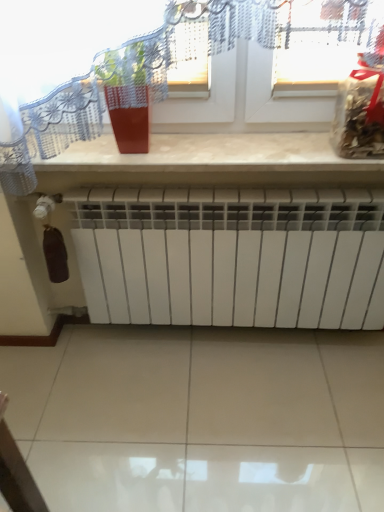
In order to face matte red pot at upper center, should I rotate leftwards or rightwards?

To align with it, rotate left about 8.091°.

Describe the element at coordinates (265, 65) in the screenshot. I see `transparent glass window at upper center` at that location.

Locate an element on the screen. This screenshot has height=512, width=384. matte red pot at upper center is located at coordinates (133, 87).

Which is behind, matte red pot at upper center or translucent plastic bag at upper right?

matte red pot at upper center.

Between matte red pot at upper center and translucent plastic bag at upper right, which one has larger size?

Bigger between the two is translucent plastic bag at upper right.

Is point (152, 93) closer or farther from the camera than point (356, 108)?

Point (152, 93) is positioned closer to the camera compared to point (356, 108).

Which object is thinner, matte red pot at upper center or translucent plastic bag at upper right?

With smaller width is matte red pot at upper center.

Considering the sizes of objects white matte radiator at lower center and transparent glass window at upper center in the image provided, who is taller, white matte radiator at lower center or transparent glass window at upper center?

white matte radiator at lower center is taller.

Considering the positions of objects white matte radiator at lower center and transparent glass window at upper center in the image provided, who is more to the left, white matte radiator at lower center or transparent glass window at upper center?

Positioned to the left is transparent glass window at upper center.

From the image's perspective, would you say white matte radiator at lower center is shown under transparent glass window at upper center?

Yes.

From a real-world perspective, is white matte radiator at lower center below transparent glass window at upper center?

Yes, from a real-world perspective, white matte radiator at lower center is under transparent glass window at upper center.

Is beige marble counter at upper center surrounded by matte red pot at upper center?

No, beige marble counter at upper center is not inside matte red pot at upper center.

From a real-world perspective, is matte red pot at upper center physically located above or below beige marble counter at upper center?

Clearly, from a real-world perspective, matte red pot at upper center is above beige marble counter at upper center.

Looking at this image, which of these two, matte red pot at upper center or beige marble counter at upper center, stands shorter?

Standing shorter between the two is beige marble counter at upper center.

Where is `houseplant in front of the beige marble counter at upper center`? Image resolution: width=384 pixels, height=512 pixels. houseplant in front of the beige marble counter at upper center is located at coordinates (133, 87).

From the image's perspective, is white matte radiator at lower center positioned above or below beige marble counter at upper center?

white matte radiator at lower center is situated lower than beige marble counter at upper center in the image.

Is white matte radiator at lower center next to beige marble counter at upper center?

They are not placed beside each other.

Image resolution: width=384 pixels, height=512 pixels. Find the location of `counter top above the white matte radiator at lower center (from a real-world perspective)`. counter top above the white matte radiator at lower center (from a real-world perspective) is located at coordinates (208, 163).

Is white matte radiator at lower center oriented away from beige marble counter at upper center?

No.

In the scene shown: Can you confirm if transparent glass window at upper center is thinner than beige marble counter at upper center?

Correct, the width of transparent glass window at upper center is less than that of beige marble counter at upper center.

From a real-world perspective, who is located lower, transparent glass window at upper center or beige marble counter at upper center?

From a 3D spatial view, beige marble counter at upper center is below.

Which is less distant, (x=59, y=61) or (x=206, y=160)?

The point (x=59, y=61) is more forward.

How distant is transparent glass window at upper center from beige marble counter at upper center?

6.42 inches.

Is translucent plastic bag at upper right far from white matte radiator at lower center?

They are positioned close to each other.

Considering the sizes of translucent plastic bag at upper right and white matte radiator at lower center in the image, is translucent plastic bag at upper right taller or shorter than white matte radiator at lower center?

translucent plastic bag at upper right is shorter than white matte radiator at lower center.

Is translucent plastic bag at upper right completely or partially outside of white matte radiator at lower center?

Yes, translucent plastic bag at upper right is located beyond the bounds of white matte radiator at lower center.

From the image's perspective, would you say translucent plastic bag at upper right is shown under matte red pot at upper center?

Indeed, from the image's perspective, translucent plastic bag at upper right is shown beneath matte red pot at upper center.

Does translucent plastic bag at upper right have a larger size compared to matte red pot at upper center?

Indeed, translucent plastic bag at upper right has a larger size compared to matte red pot at upper center.

Does translucent plastic bag at upper right come in front of matte red pot at upper center?

Yes, the depth of translucent plastic bag at upper right is less than that of matte red pot at upper center.

Between translucent plastic bag at upper right and matte red pot at upper center, which one has more height?

Standing taller between the two is translucent plastic bag at upper right.

Where is `food on the right of matte red pot at upper center`? The height and width of the screenshot is (512, 384). food on the right of matte red pot at upper center is located at coordinates (361, 110).

Locate an element on the screen. window in front of the white matte radiator at lower center is located at coordinates (265, 65).

Based on their spatial positions, is transparent glass window at upper center or white matte radiator at lower center closer to matte red pot at upper center?

transparent glass window at upper center is positioned closer to the anchor matte red pot at upper center.

Looking at the image, which one is located closer to beige marble counter at upper center, white matte radiator at lower center or translucent plastic bag at upper right?

Among the two, white matte radiator at lower center is located nearer to beige marble counter at upper center.

Estimate the real-world distances between objects in this image. Which object is closer to translucent plastic bag at upper right, transparent glass window at upper center or white matte radiator at lower center?

Based on the image, transparent glass window at upper center appears to be nearer to translucent plastic bag at upper right.

When comparing their distances from translucent plastic bag at upper right, does matte red pot at upper center or beige marble counter at upper center seem closer?

Based on the image, beige marble counter at upper center appears to be nearer to translucent plastic bag at upper right.

Looking at the image, which one is located closer to transparent glass window at upper center, white matte radiator at lower center or beige marble counter at upper center?

Among the two, beige marble counter at upper center is located nearer to transparent glass window at upper center.

Based on their spatial positions, is matte red pot at upper center or white matte radiator at lower center closer to beige marble counter at upper center?

Based on the image, white matte radiator at lower center appears to be nearer to beige marble counter at upper center.

Which object lies nearer to the anchor point transparent glass window at upper center, white matte radiator at lower center or matte red pot at upper center?

Among the two, matte red pot at upper center is located nearer to transparent glass window at upper center.

Based on their spatial positions, is matte red pot at upper center or beige marble counter at upper center closer to white matte radiator at lower center?

Among the two, beige marble counter at upper center is located nearer to white matte radiator at lower center.

At what (x,y) coordinates should I click in order to perform the action: click on counter top that lies between matte red pot at upper center and white matte radiator at lower center from top to bottom. Please return your answer as a coordinate pair (x, y). The height and width of the screenshot is (512, 384). Looking at the image, I should click on (208, 163).

This screenshot has height=512, width=384. What are the coordinates of `window between matte red pot at upper center and translucent plastic bag at upper right in the horizontal direction` in the screenshot? It's located at (265, 65).

You are a GUI agent. You are given a task and a screenshot of the screen. Output one action in this format:
    pyautogui.click(x=<x>, y=<y>)
    Task: Click on the counter top located between transparent glass window at upper center and translucent plastic bag at upper right in the left-right direction
    Image resolution: width=384 pixels, height=512 pixels.
    Given the screenshot: What is the action you would take?
    pyautogui.click(x=208, y=163)

What are the coordinates of `radiator situated between matte red pot at upper center and translucent plastic bag at upper right from left to right` in the screenshot? It's located at (232, 256).